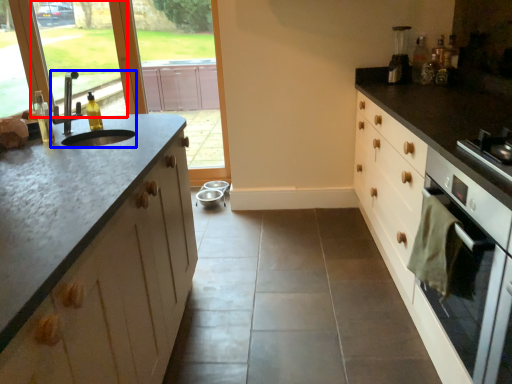
Question: Which of the following is the closest to the observer, window screen (highlighted by a red box) or sink (highlighted by a blue box)?

Choices:
 (A) window screen
 (B) sink

Answer: (B)